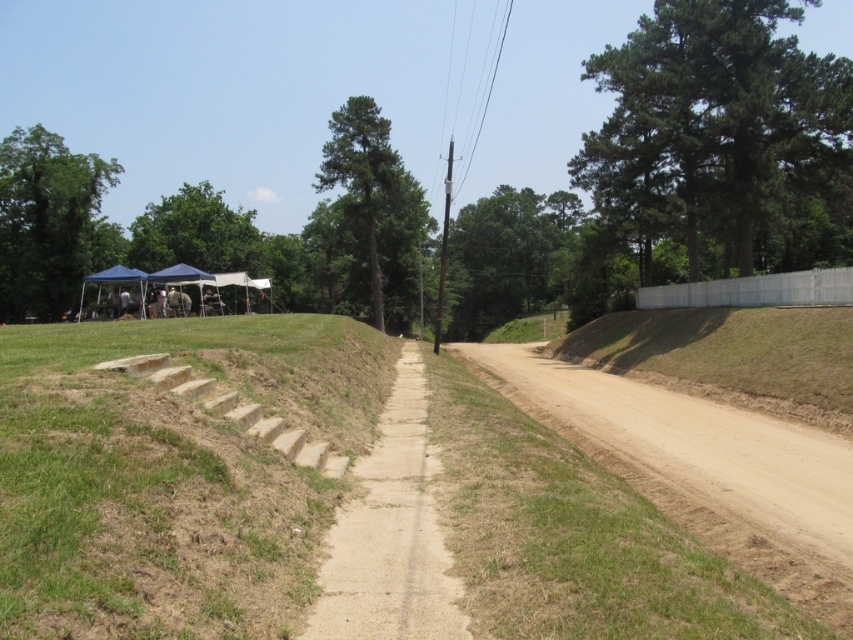
Which of these two, green grass at lower left or green leafy tree at upper right, stands taller?

Standing taller between the two is green leafy tree at upper right.

Find the location of a particular element. Image resolution: width=853 pixels, height=640 pixels. green grass at lower left is located at coordinates (172, 474).

What do you see at coordinates (172, 474) in the screenshot? The width and height of the screenshot is (853, 640). I see `green grass at lower left` at bounding box center [172, 474].

Find the location of a particular element. This screenshot has height=640, width=853. green grass at lower left is located at coordinates (172, 474).

Can you confirm if green leafy tree at upper right is shorter than green matte tree at center?

Yes, green leafy tree at upper right is shorter than green matte tree at center.

The image size is (853, 640). In order to click on green leafy tree at upper right in this screenshot , I will do (x=722, y=140).

Does green leafy tree at upper right appear over dirt/gravel path at center?

Indeed, green leafy tree at upper right is positioned over dirt/gravel path at center.

Who is more distant from viewer, (708,38) or (416,468)?

Point (708,38)

Locate an element on the screen. green leafy tree at upper right is located at coordinates (722, 140).